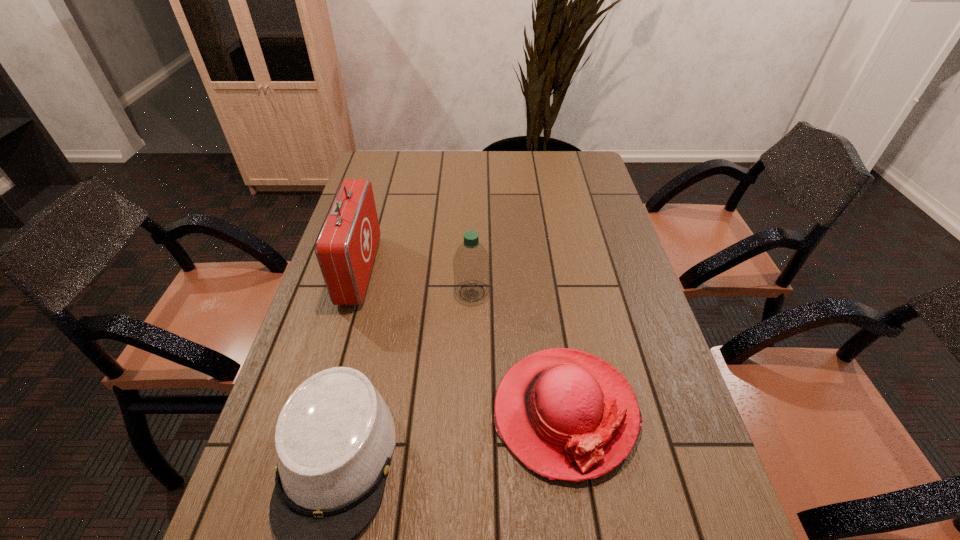
Identify the location of the first-aid kit. (346, 247).

Identify the location of the second object from right to left. (471, 264).

Locate an element on the screen. This screenshot has height=540, width=960. water bottle is located at coordinates (471, 264).

You are a GUI agent. You are given a task and a screenshot of the screen. Output one action in this format:
    pyautogui.click(x=<x>, y=<y>)
    Task: Click on the right hat
    This screenshot has height=540, width=960.
    Given the screenshot: What is the action you would take?
    pyautogui.click(x=566, y=414)

The height and width of the screenshot is (540, 960). I want to click on vacant space located on the side of the tallest object with the first aid cross symbol, so click(x=435, y=270).

The width and height of the screenshot is (960, 540). What are the coordinates of `blank area located 0.160m on the front of the second object from right to left` in the screenshot? It's located at (471, 355).

Image resolution: width=960 pixels, height=540 pixels. Identify the location of free location located at the front of the right hat with a bow. (582, 526).

This screenshot has height=540, width=960. Identify the location of object present at the left edge. (346, 247).

At what (x,y) coordinates should I click in order to perform the action: click on object present at the right edge. Please return your answer as a coordinate pair (x, y). Looking at the image, I should click on (566, 414).

In order to click on blank space at the far edge of the desktop in this screenshot , I will do `click(468, 156)`.